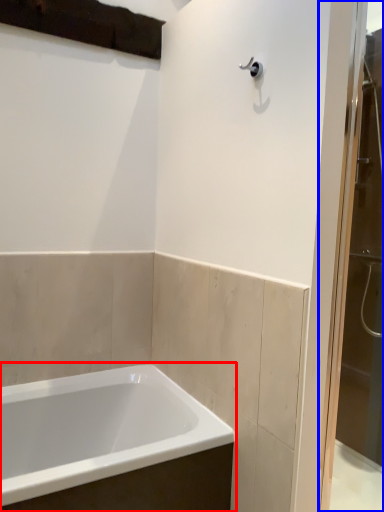
Question: Which point is closer to the camera, bathtub (highlighted by a red box) or screen door (highlighted by a blue box)?

Choices:
 (A) bathtub
 (B) screen door

Answer: (A)